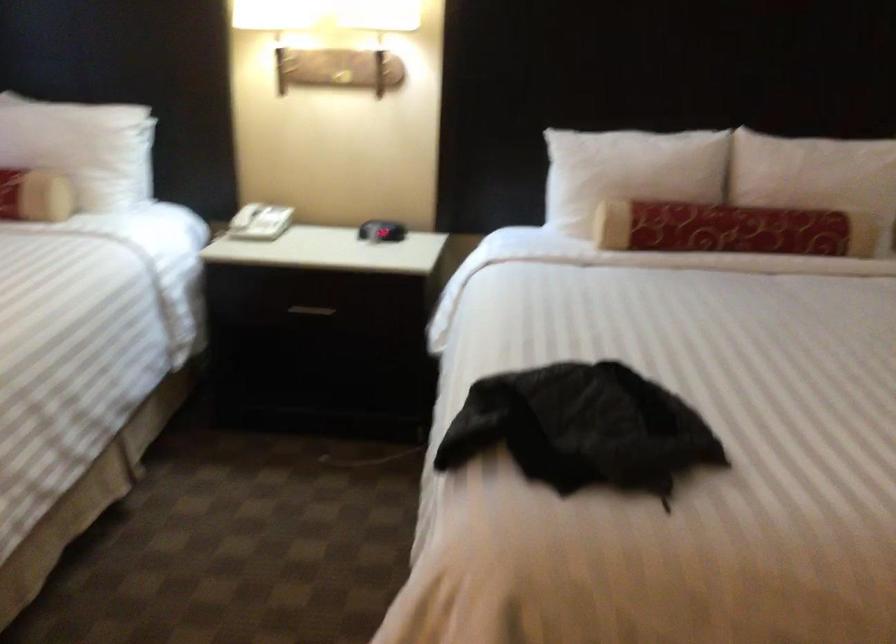
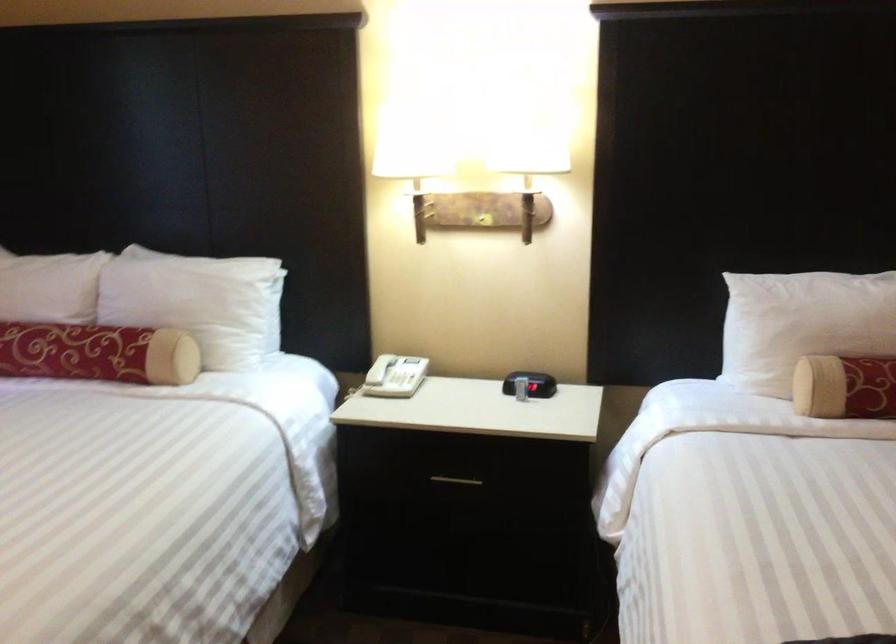
Find the pixel in the second image that matches point 270,225 in the first image.

(405, 380)